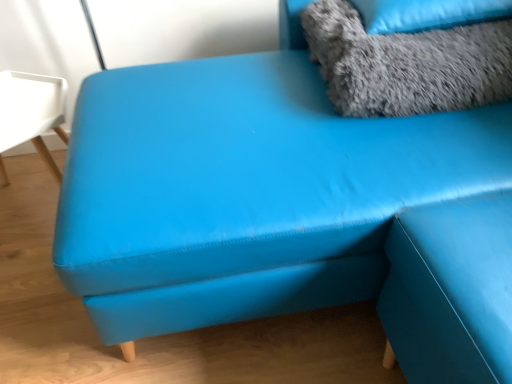
I want to click on gray fluffy pillow at upper right, so click(x=426, y=14).

What do you see at coordinates (426, 14) in the screenshot? This screenshot has width=512, height=384. I see `gray fluffy pillow at upper right` at bounding box center [426, 14].

What do you see at coordinates (407, 64) in the screenshot? I see `gray fluffy pillow at upper right` at bounding box center [407, 64].

I want to click on gray fluffy pillow at upper right, so click(x=407, y=64).

Image resolution: width=512 pixels, height=384 pixels. What are the coordinates of `gray fluffy pillow at upper right` in the screenshot? It's located at (426, 14).

Does gray fluffy pillow at upper right appear on the left side of gray fluffy pillow at upper right?

Correct, you'll find gray fluffy pillow at upper right to the left of gray fluffy pillow at upper right.

Is gray fluffy pillow at upper right positioned before gray fluffy pillow at upper right?

Yes.

Considering the positions of points (457, 65) and (455, 15), is point (457, 65) farther from camera compared to point (455, 15)?

No, it is in front of (455, 15).

From the image's perspective, is gray fluffy pillow at upper right on top of gray fluffy pillow at upper right?

Incorrect, from the image's perspective, gray fluffy pillow at upper right is lower than gray fluffy pillow at upper right.

From a real-world perspective, is gray fluffy pillow at upper right over gray fluffy pillow at upper right?

Actually, gray fluffy pillow at upper right is physically below gray fluffy pillow at upper right in the real world.

Between gray fluffy pillow at upper right and gray fluffy pillow at upper right, which one has smaller width?

With smaller width is gray fluffy pillow at upper right.

Considering the sizes of gray fluffy pillow at upper right and gray fluffy pillow at upper right in the image, is gray fluffy pillow at upper right taller or shorter than gray fluffy pillow at upper right?

In the image, gray fluffy pillow at upper right appears to be taller than gray fluffy pillow at upper right.

Which of these two, gray fluffy pillow at upper right or gray fluffy pillow at upper right, is smaller?

Smaller between the two is gray fluffy pillow at upper right.

Is gray fluffy pillow at upper right positioned beyond the bounds of gray fluffy pillow at upper right?

gray fluffy pillow at upper right is positioned outside gray fluffy pillow at upper right.

Consider the image. Are gray fluffy pillow at upper right and gray fluffy pillow at upper right located far from each other?

gray fluffy pillow at upper right is near gray fluffy pillow at upper right, not far away.

Is gray fluffy pillow at upper right turned away from gray fluffy pillow at upper right?

gray fluffy pillow at upper right is not turned away from gray fluffy pillow at upper right.

How different are the orientations of gray fluffy pillow at upper right and gray fluffy pillow at upper right in degrees?

They differ by 1.29 degrees in their facing directions.

You are a GUI agent. You are given a task and a screenshot of the screen. Output one action in this format:
    pyautogui.click(x=<x>, y=<y>)
    Task: Click on the pillow above the gray fluffy pillow at upper right (from a real-world perspective)
    The image size is (512, 384).
    Given the screenshot: What is the action you would take?
    pyautogui.click(x=426, y=14)

Considering the relative positions of gray fluffy pillow at upper right and gray fluffy pillow at upper right in the image provided, is gray fluffy pillow at upper right to the left or to the right of gray fluffy pillow at upper right?

Clearly, gray fluffy pillow at upper right is on the right of gray fluffy pillow at upper right in the image.

Which is in front, gray fluffy pillow at upper right or gray fluffy pillow at upper right?

Positioned in front is gray fluffy pillow at upper right.

Does point (474, 0) come farther from viewer compared to point (429, 70)?

Yes.

From the image's perspective, between gray fluffy pillow at upper right and gray fluffy pillow at upper right, which one is located above?

gray fluffy pillow at upper right appears higher in the image.

From the picture: From a real-world perspective, is gray fluffy pillow at upper right under gray fluffy pillow at upper right?

Actually, gray fluffy pillow at upper right is physically above gray fluffy pillow at upper right in the real world.

Does gray fluffy pillow at upper right have a lesser width compared to gray fluffy pillow at upper right?

No, gray fluffy pillow at upper right is not thinner than gray fluffy pillow at upper right.

Considering the sizes of gray fluffy pillow at upper right and gray fluffy pillow at upper right in the image, is gray fluffy pillow at upper right taller or shorter than gray fluffy pillow at upper right?

gray fluffy pillow at upper right is shorter than gray fluffy pillow at upper right.

Is gray fluffy pillow at upper right bigger than gray fluffy pillow at upper right?

Incorrect, gray fluffy pillow at upper right is not larger than gray fluffy pillow at upper right.

Is gray fluffy pillow at upper right not inside gray fluffy pillow at upper right?

Actually, gray fluffy pillow at upper right is at least partially inside gray fluffy pillow at upper right.

Does gray fluffy pillow at upper right touch gray fluffy pillow at upper right?

Absolutely, gray fluffy pillow at upper right is next to and touching gray fluffy pillow at upper right.

Is gray fluffy pillow at upper right aimed at gray fluffy pillow at upper right?

No, gray fluffy pillow at upper right does not turn towards gray fluffy pillow at upper right.

Identify the location of animal beneath the gray fluffy pillow at upper right (from a real-world perspective). The image size is (512, 384). (407, 64).

The image size is (512, 384). Identify the location of pillow above the gray fluffy pillow at upper right (from a real-world perspective). (426, 14).

Identify the location of pillow lying above the gray fluffy pillow at upper right (from the image's perspective). The height and width of the screenshot is (384, 512). (426, 14).